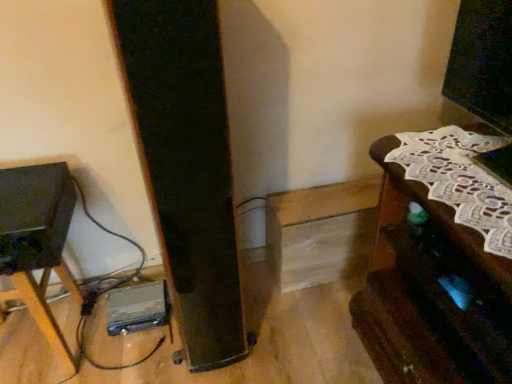
Locate an element on the screen. This screenshot has width=512, height=384. empty space that is to the right of metallic silver tripod at lower left, the 1th furniture positioned from the left is located at coordinates (111, 347).